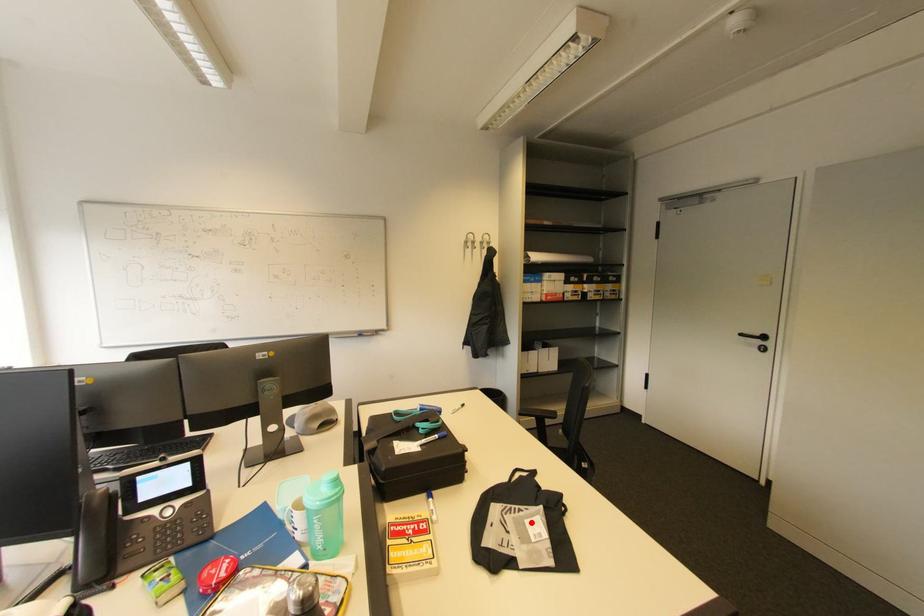
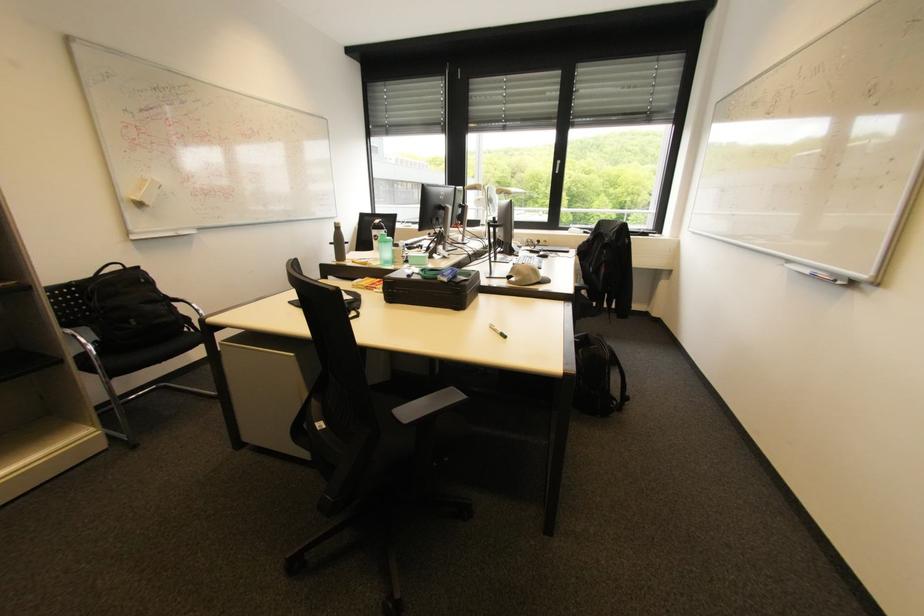
Question: I am providing you with two images of the same scene from different viewpoints. A red point is marked on the first image. Is the red point's position out of view in image 2?

Choices:
 (A) Yes
 (B) No

Answer: (A)